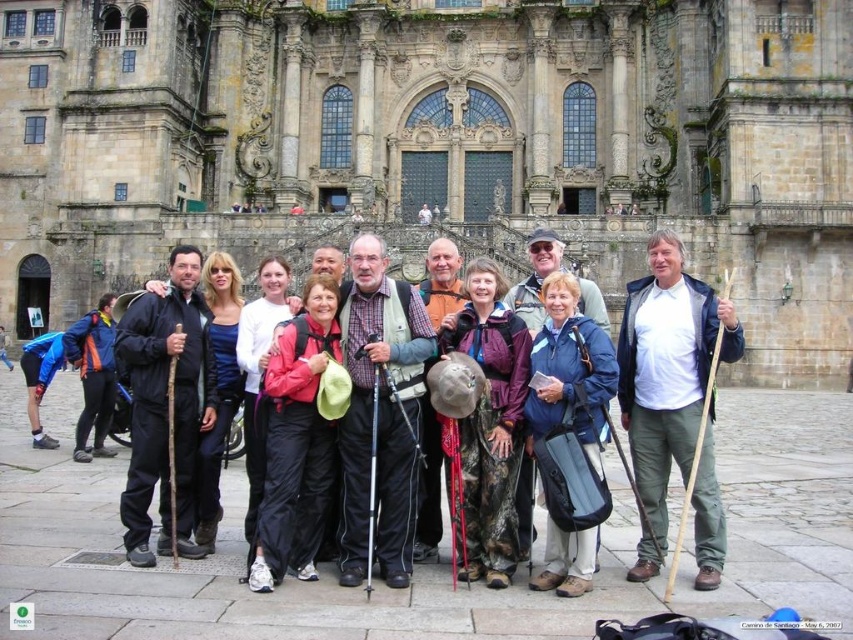
Does black fabric backpack at center appear over camouflage fabric hat at center?

Yes, black fabric backpack at center is above camouflage fabric hat at center.

Does black fabric backpack at center lie in front of camouflage fabric hat at center?

No, it is behind camouflage fabric hat at center.

Describe the element at coordinates (165, 404) in the screenshot. Image resolution: width=853 pixels, height=640 pixels. I see `black fabric backpack at center` at that location.

Image resolution: width=853 pixels, height=640 pixels. Find the location of `black fabric backpack at center`. black fabric backpack at center is located at coordinates (165, 404).

Which is above, stone textured palace at center or camouflage fabric hat at center?

stone textured palace at center

Describe the element at coordinates (437, 145) in the screenshot. The height and width of the screenshot is (640, 853). I see `stone textured palace at center` at that location.

Find the location of a particular element. The width and height of the screenshot is (853, 640). stone textured palace at center is located at coordinates (437, 145).

Is plaid fabric shirt at center further to the viewer compared to matte pink jacket at center?

Yes, it is.

Between plaid fabric shirt at center and matte pink jacket at center, which one has more height?

With more height is plaid fabric shirt at center.

Who is more forward, (369, 385) or (328, 340)?

Point (369, 385) is more forward.

Image resolution: width=853 pixels, height=640 pixels. What are the coordinates of `plaid fabric shirt at center` in the screenshot? It's located at (379, 412).